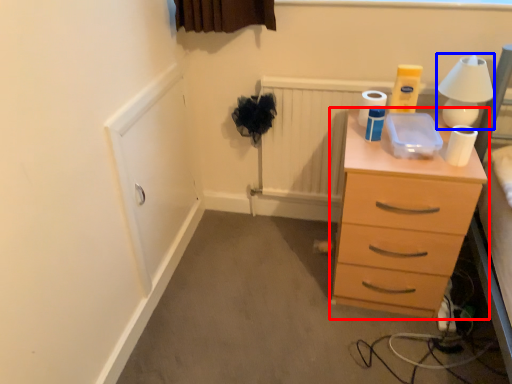
Question: Among these objects, which one is farthest to the camera, chest of drawers (highlighted by a red box) or table lamp (highlighted by a blue box)?

Choices:
 (A) chest of drawers
 (B) table lamp

Answer: (B)